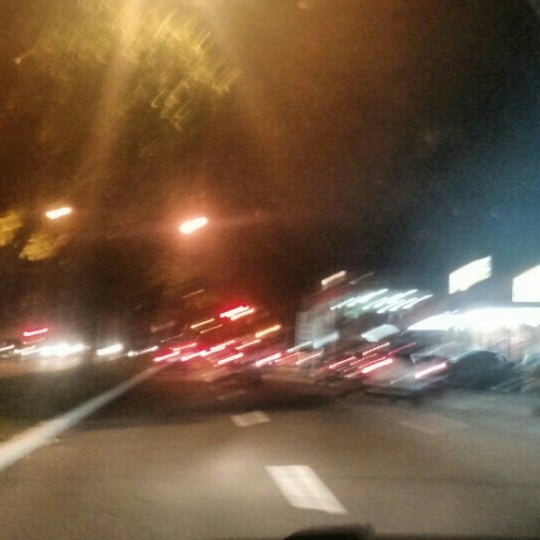
Image resolution: width=540 pixels, height=540 pixels. I want to click on light, so click(x=326, y=67).